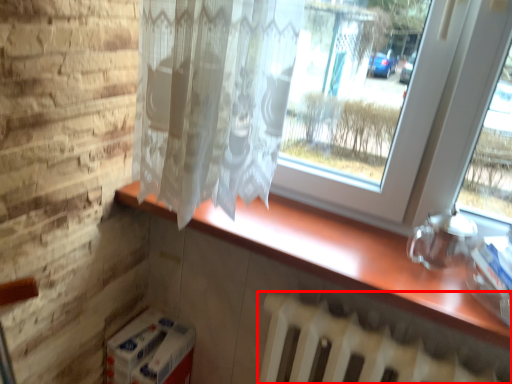
Question: Observing the image, what is the correct spatial positioning of radiator (annotated by the red box) in reference to counter top?

Choices:
 (A) left
 (B) right

Answer: (B)